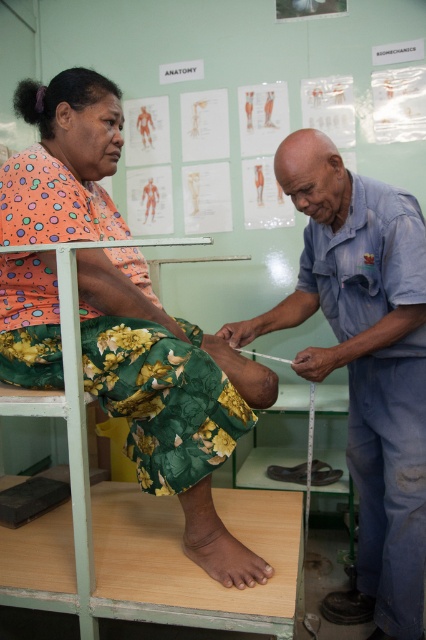
Please describe the location of the point at coordinates (365, 364) in the scene. Which object is located at this point?

The point at coordinates (365, 364) corresponds to the blue denim shirt at center.

You are a healthcare professional trying to position a new medical device in the room. The device must be placed between the two points labeled point (409, 211) and point (195, 547). Based on their positions, which point should the device be closer to?

The device should be placed closer to point (195, 547) because point (409, 211) is behind it.

You are a nurse in the room and need to determine which object has a greater width between the blue denim shirt at center and the brown matte skin at lower center. Based on the scene, which one is wider?

The blue denim shirt at center is wider than the brown matte skin at lower center.